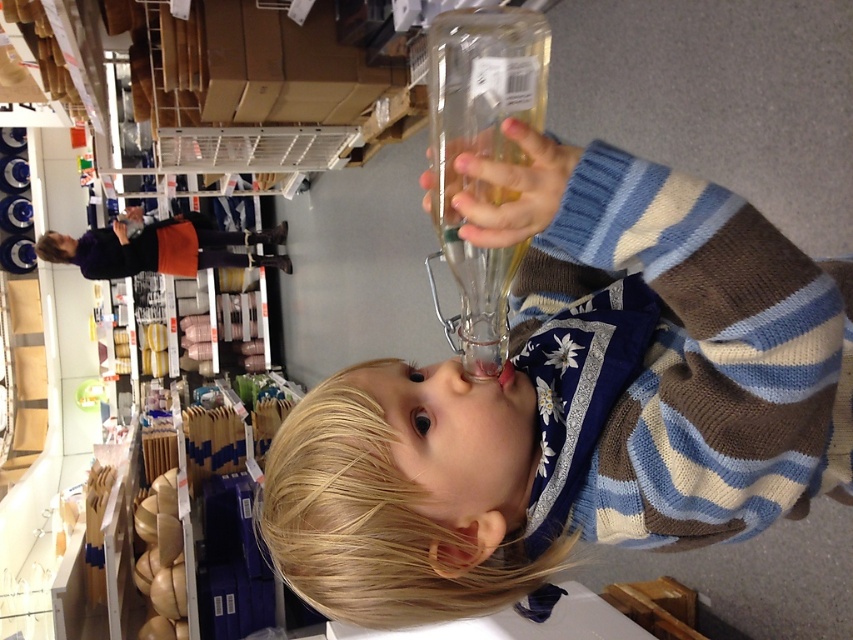
From the picture: Can you confirm if clear glass bottle at center is bigger than matte purple sweater at upper left?

Incorrect, clear glass bottle at center is not larger than matte purple sweater at upper left.

Looking at this image, how much distance is there between clear glass bottle at center and matte purple sweater at upper left?

clear glass bottle at center is 4.25 meters away from matte purple sweater at upper left.

Between point (711, 284) and point (57, 259), which one is positioned behind?

The point (57, 259) is behind.

In order to click on clear glass bottle at center in this screenshot , I will do `click(573, 412)`.